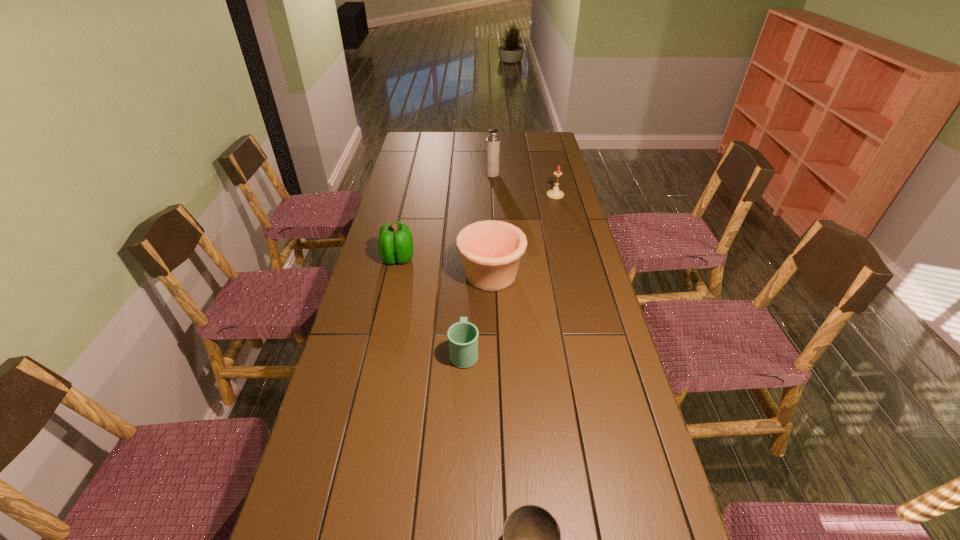
I want to click on free spot at the far left corner of the desktop, so click(x=419, y=143).

The width and height of the screenshot is (960, 540). I want to click on free space between the pottery and the bell pepper, so click(x=444, y=267).

Where is `free point between the pottery and the leftmost object`? This screenshot has height=540, width=960. free point between the pottery and the leftmost object is located at coordinates (444, 267).

This screenshot has width=960, height=540. Find the location of `free space between the thermos bottle and the bell pepper`. free space between the thermos bottle and the bell pepper is located at coordinates (445, 217).

This screenshot has width=960, height=540. I want to click on object that stands as the third closest to the pottery, so click(x=555, y=193).

Identify the location of the fifth closest object relative to the mug. The image size is (960, 540). (493, 141).

Where is `free spot that satisfies the following two spatial constraints: 1. on the side of the mug with the handle; 2. on the left side of the pottery`? free spot that satisfies the following two spatial constraints: 1. on the side of the mug with the handle; 2. on the left side of the pottery is located at coordinates (467, 275).

The width and height of the screenshot is (960, 540). I want to click on vacant region that satisfies the following two spatial constraints: 1. on the side of the fifth farthest object with the handle; 2. on the right side of the pottery, so point(467,275).

Identify the location of free space that satisfies the following two spatial constraints: 1. on the front side of the second farthest object; 2. on the right side of the farthest object. The image size is (960, 540). (493, 195).

Image resolution: width=960 pixels, height=540 pixels. Find the location of `vacant space that satisfies the following two spatial constraints: 1. on the side of the mug with the handle; 2. on the left side of the rightmost object`. vacant space that satisfies the following two spatial constraints: 1. on the side of the mug with the handle; 2. on the left side of the rightmost object is located at coordinates (469, 195).